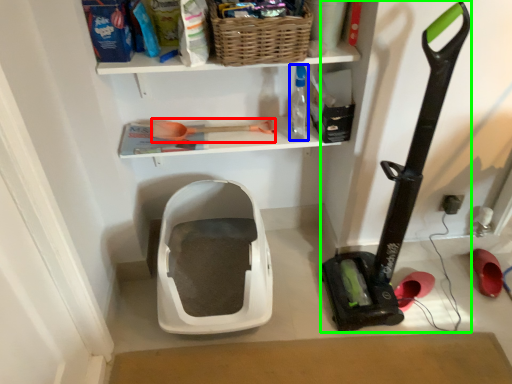
Question: Which object is the farthest from shovel (highlighted by a red box)? Choose among these: bottle (highlighted by a blue box) or equipment (highlighted by a green box).

Choices:
 (A) bottle
 (B) equipment

Answer: (B)